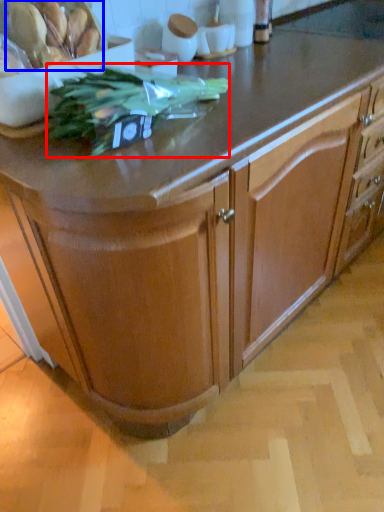
Question: Which object appears closest to the camera in this image, plant (highlighted by a red box) or food (highlighted by a blue box)?

Choices:
 (A) plant
 (B) food

Answer: (A)